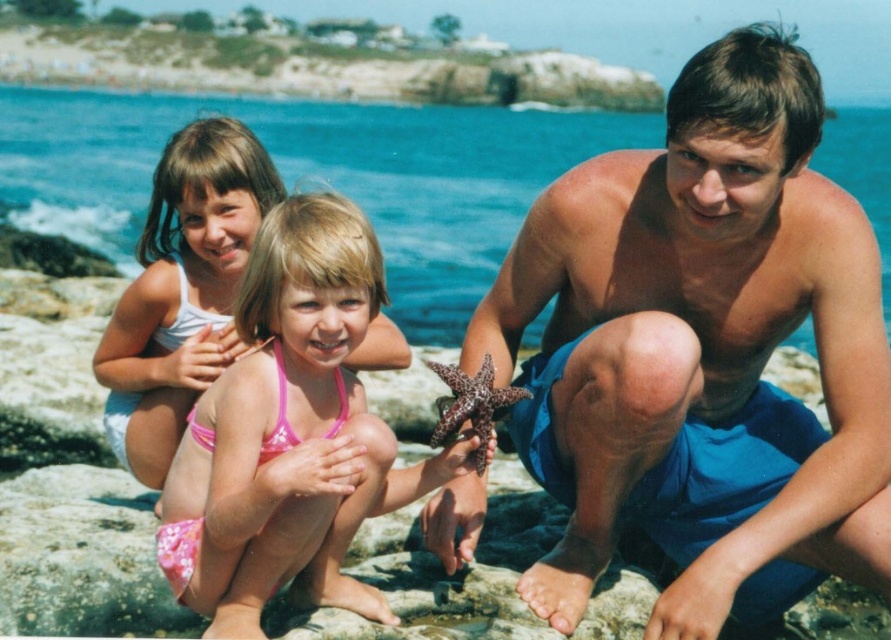
Question: Which point appears closest to the camera in this image?

Choices:
 (A) (734, 488)
 (B) (492, 369)
 (C) (577, 147)

Answer: (B)

Question: Can you confirm if blue water at upper center is positioned to the right of brown spotted starfish at center?

Choices:
 (A) yes
 (B) no

Answer: (B)

Question: Based on their relative distances, which object is farther from the pink fabric bikini at center?

Choices:
 (A) brown spotted starfish at center
 (B) blue fabric shorts at center
 (C) pink fabric bikini at upper left
 (D) blue water at upper center

Answer: (D)

Question: Does pink fabric bikini at upper left have a larger size compared to brown spotted starfish at center?

Choices:
 (A) no
 (B) yes

Answer: (A)

Question: Which is nearer to the pink fabric bikini at upper left?

Choices:
 (A) pink fabric bikini at center
 (B) blue fabric shorts at center

Answer: (A)

Question: Is blue fabric shorts at center to the left of pink fabric bikini at center from the viewer's perspective?

Choices:
 (A) yes
 (B) no

Answer: (B)